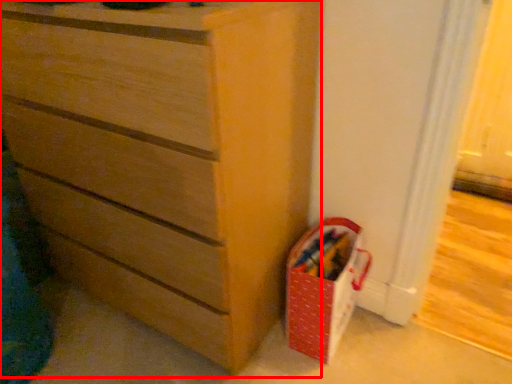
Question: Where is chest of drawers (annotated by the red box) located in relation to kit in the image?

Choices:
 (A) right
 (B) left

Answer: (B)